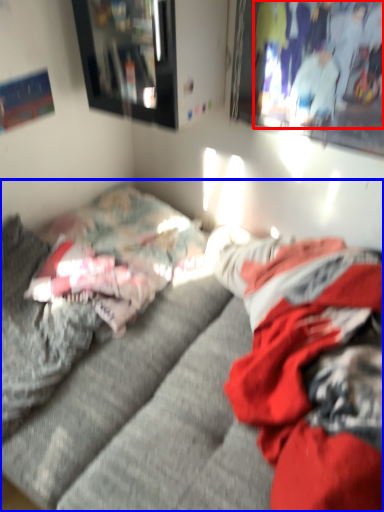
Question: Which of the following is the closest to the observer, couple (highlighted by a red box) or studio couch (highlighted by a blue box)?

Choices:
 (A) couple
 (B) studio couch

Answer: (B)